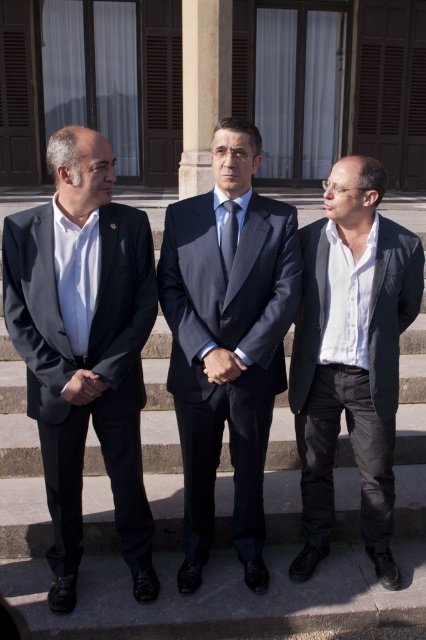
Is gray concrete stairs at center above blue silk tie at center?

Incorrect, gray concrete stairs at center is not positioned above blue silk tie at center.

Is gray concrete stairs at center taller than blue silk tie at center?

Yes, gray concrete stairs at center is taller than blue silk tie at center.

Is point (19, 529) in front of point (233, 228)?

No, (19, 529) is further to viewer.

At what (x,y) coordinates should I click in order to perform the action: click on gray concrete stairs at center. Please return your answer as a coordinate pair (x, y). This screenshot has height=640, width=426. Looking at the image, I should click on (158, 408).

Is point (368, 268) positioned before point (238, 228)?

No, (368, 268) is further to viewer.

Locate an element on the screen. matte black suit at right is located at coordinates (351, 356).

Which is more to the right, matte black suit at left or dark gray suit at center?

Positioned to the right is dark gray suit at center.

Between point (141, 236) and point (192, 244), which one is positioned behind?

Point (192, 244)

Where is `matte black suit at left`? matte black suit at left is located at coordinates (83, 346).